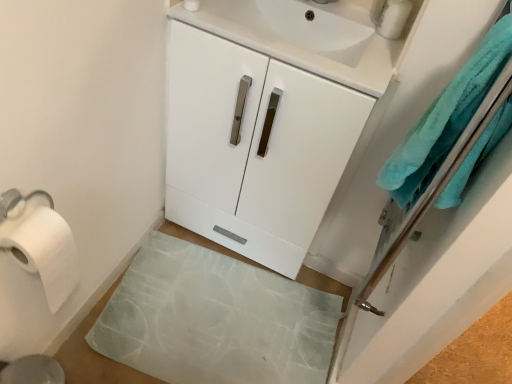
The height and width of the screenshot is (384, 512). I want to click on free space in front of metallic silver soap dispenser at upper right, so click(x=364, y=55).